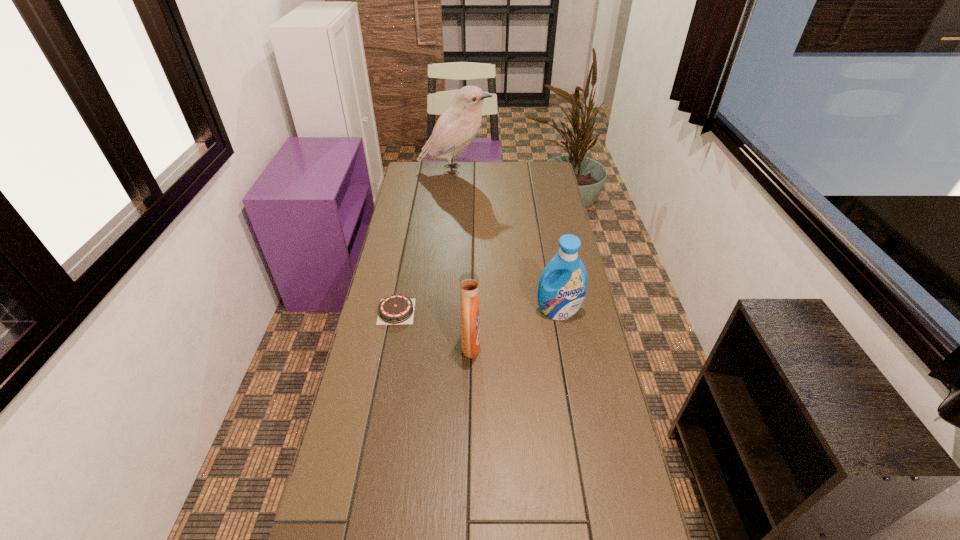
Identify the location of object that is the third closest to the parakeet. (469, 282).

Identify the location of free spot that satisfies the following two spatial constraints: 1. on the face of the tallest object; 2. on the front side of the chocolate cake. (443, 311).

Where is `free region that satisfies the following two spatial constraints: 1. on the front-facing side of the rightmost object; 2. on the front-facing side of the left detergent`? The image size is (960, 540). free region that satisfies the following two spatial constraints: 1. on the front-facing side of the rightmost object; 2. on the front-facing side of the left detergent is located at coordinates (564, 346).